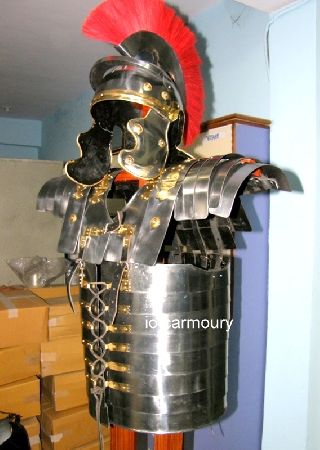
You are a GUI agent. You are given a task and a screenshot of the screen. Output one action in this format:
    pyautogui.click(x=<x>, y=<y>)
    Task: Click on the off white ceiling
    
    Given the screenshot: What is the action you would take?
    pyautogui.click(x=62, y=17), pyautogui.click(x=271, y=5)